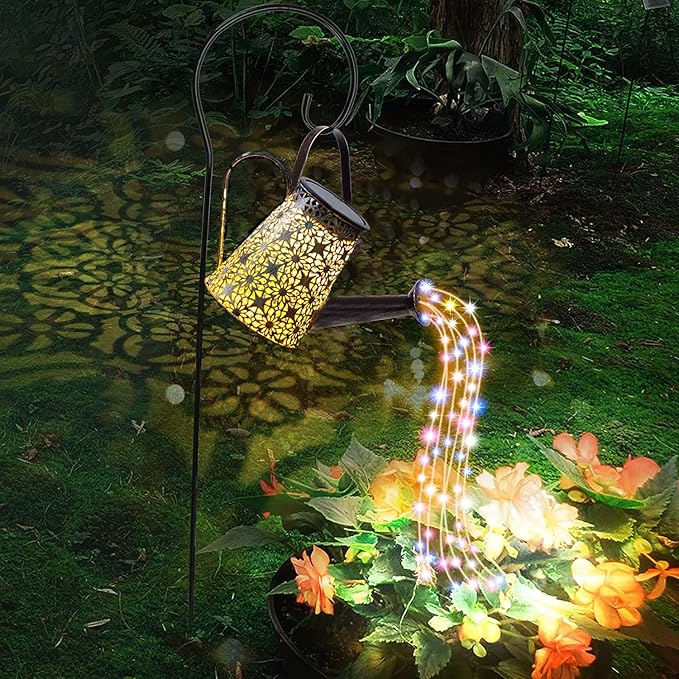
Identify the location of black rack. The image size is (679, 679). (189, 88).